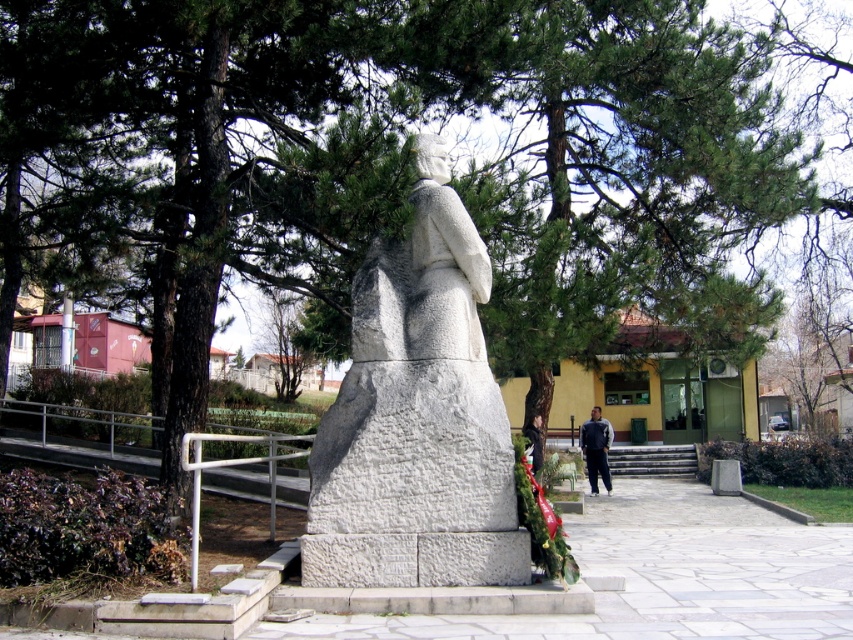
Question: Where is white stone statue at center located in relation to dark gray fabric pants at lower center in the image?

Choices:
 (A) above
 (B) below

Answer: (A)

Question: Observing the image, what is the correct spatial positioning of white stone statue at center in reference to dark gray fabric pants at lower center?

Choices:
 (A) left
 (B) right

Answer: (A)

Question: Can you confirm if white stone statue at center is positioned to the right of dark gray fabric pants at lower center?

Choices:
 (A) yes
 (B) no

Answer: (B)

Question: Among these objects, which one is farthest from the camera?

Choices:
 (A) dark gray fabric pants at lower center
 (B) white stone statue at center

Answer: (A)